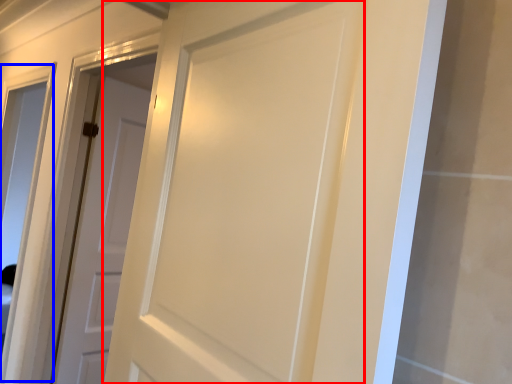
Question: Which of the following is the farthest to the observer, door (highlighted by a red box) or window (highlighted by a blue box)?

Choices:
 (A) door
 (B) window

Answer: (B)